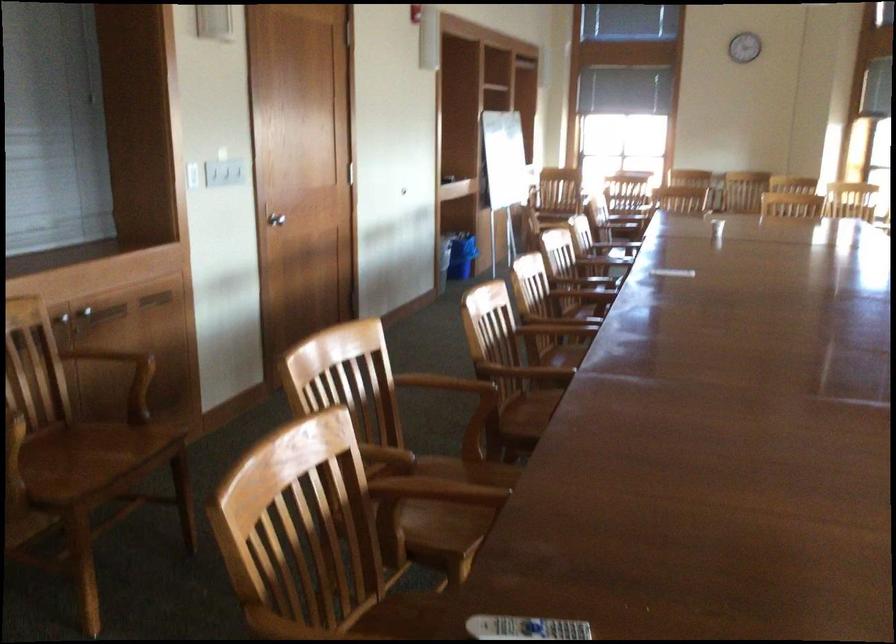
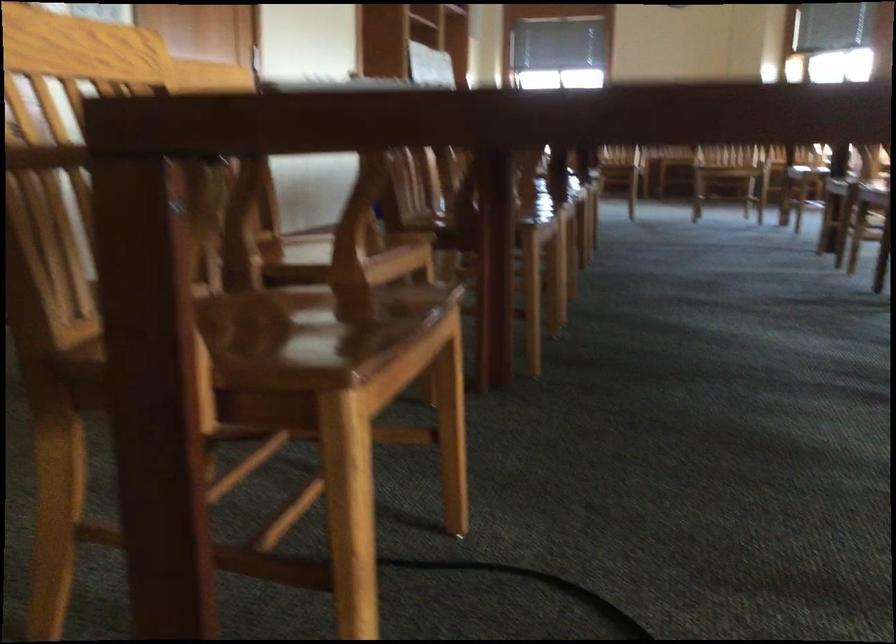
What movement of the cameraman would produce the second image?

The cameraman moved toward right, forward.